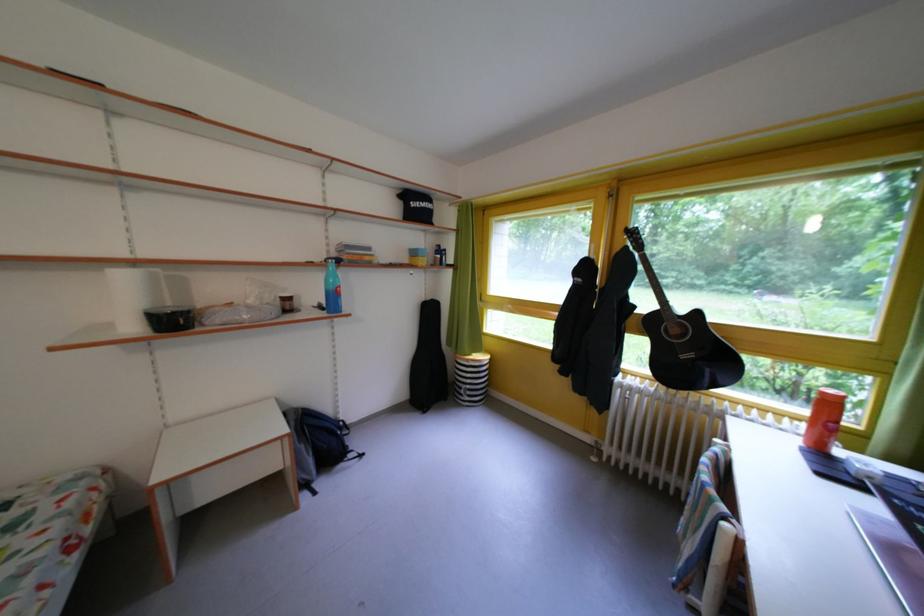
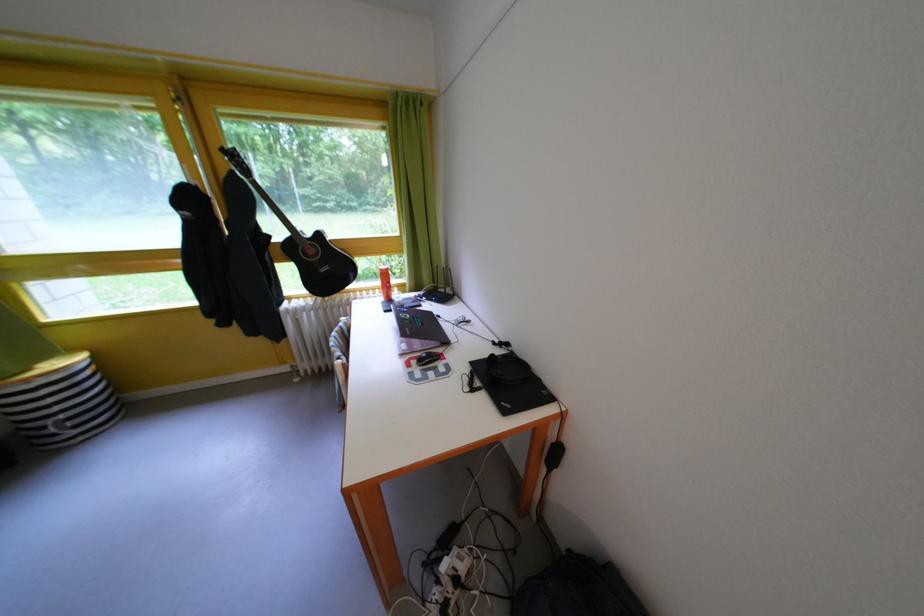
How did the camera likely rotate?

The camera's rotation is toward right-down.